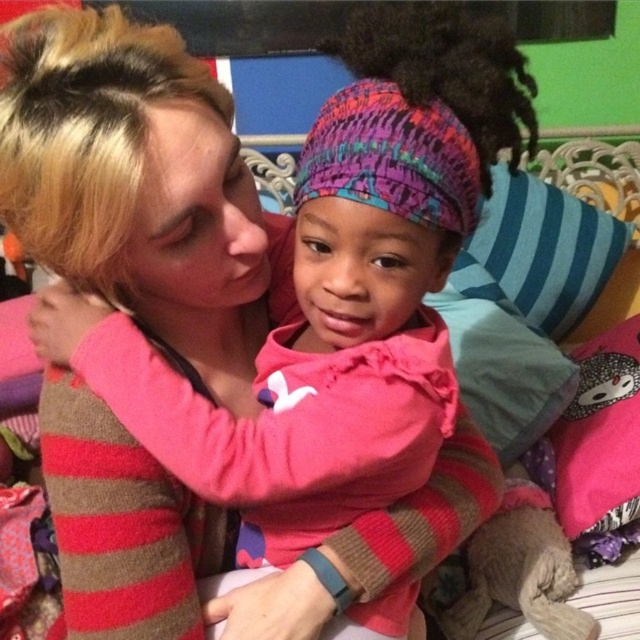
Question: Observing the image, what is the correct spatial positioning of pink fleece at center in reference to blue striped pillow at right?

Choices:
 (A) above
 (B) below

Answer: (B)

Question: Estimate the real-world distances between objects in this image. Which object is farther from the blue striped pillow at right?

Choices:
 (A) pink fabric pillow at lower right
 (B) pink fleece at center

Answer: (B)

Question: Can you confirm if pink fleece at center is positioned below blue striped pillow at right?

Choices:
 (A) no
 (B) yes

Answer: (B)

Question: Which of these objects is positioned closest to the pink fabric pillow at lower right?

Choices:
 (A) blue striped pillow at right
 (B) pink fleece at center

Answer: (A)

Question: Can you confirm if pink fleece at center is positioned to the left of pink fabric pillow at lower right?

Choices:
 (A) no
 (B) yes

Answer: (B)

Question: Which object is closer to the camera taking this photo?

Choices:
 (A) pink fleece at center
 (B) blue striped pillow at right

Answer: (A)